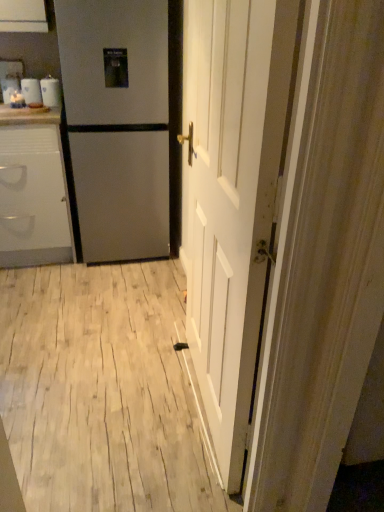
Locate an element on the screen. Image resolution: width=384 pixels, height=512 pixels. free space between satin silver refrigerator at left and white wooden door at center is located at coordinates (145, 318).